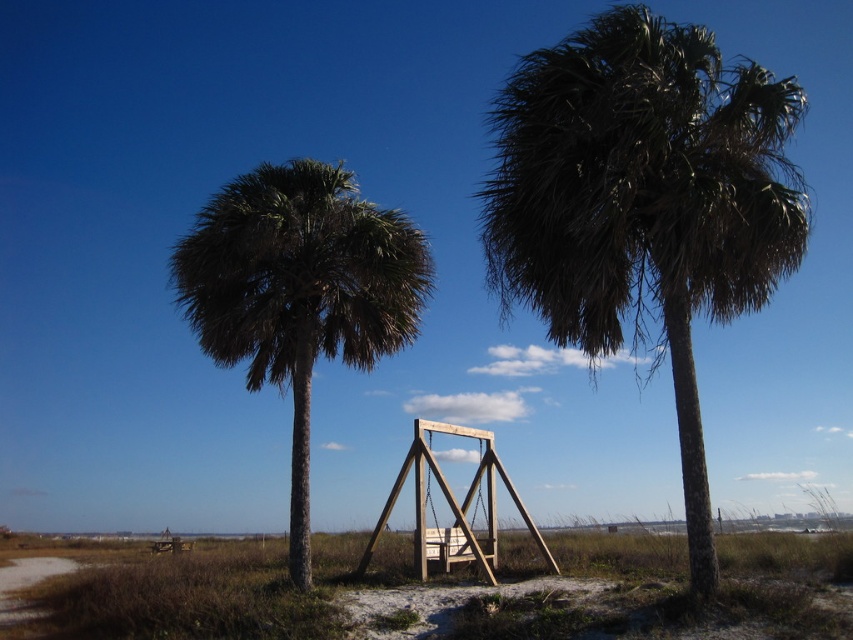
Does dark green leafy palm at center come in front of green leafy palm tree at center?

Yes, dark green leafy palm at center is closer to the viewer.

Where is `dark green leafy palm at center`? The height and width of the screenshot is (640, 853). dark green leafy palm at center is located at coordinates (643, 202).

Find the location of a particular element. The height and width of the screenshot is (640, 853). dark green leafy palm at center is located at coordinates (643, 202).